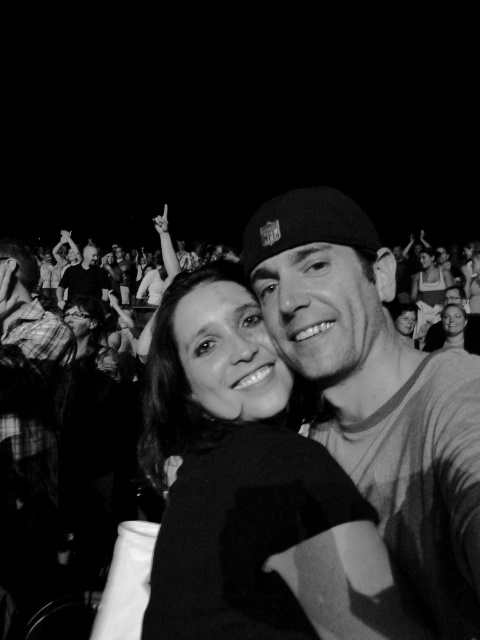
Can you confirm if smooth black shirt at center is taller than matte black cap at right?

In fact, smooth black shirt at center may be shorter than matte black cap at right.

From the picture: Does smooth black shirt at center appear over matte black cap at right?

Incorrect, smooth black shirt at center is not positioned above matte black cap at right.

The width and height of the screenshot is (480, 640). Identify the location of smooth black shirt at center. click(250, 486).

Describe the element at coordinates (428, 292) in the screenshot. This screenshot has height=640, width=480. I see `matte white tank top at center` at that location.

Who is lower down, matte white tank top at center or smooth skin man at upper left?

matte white tank top at center is lower down.

Who is more forward, (439, 296) or (95, 262)?

Point (439, 296) is more forward.

Where is `matte white tank top at center`? The width and height of the screenshot is (480, 640). matte white tank top at center is located at coordinates (428, 292).

Can you confirm if matte black cap at right is thinner than matte white tank top at center?

Correct, matte black cap at right's width is less than matte white tank top at center's.

Who is shorter, matte black cap at right or matte white tank top at center?

matte black cap at right

Where is `matte black cap at right`? This screenshot has height=640, width=480. matte black cap at right is located at coordinates (376, 392).

Find the location of a particular element. The height and width of the screenshot is (640, 480). matte black cap at right is located at coordinates (376, 392).